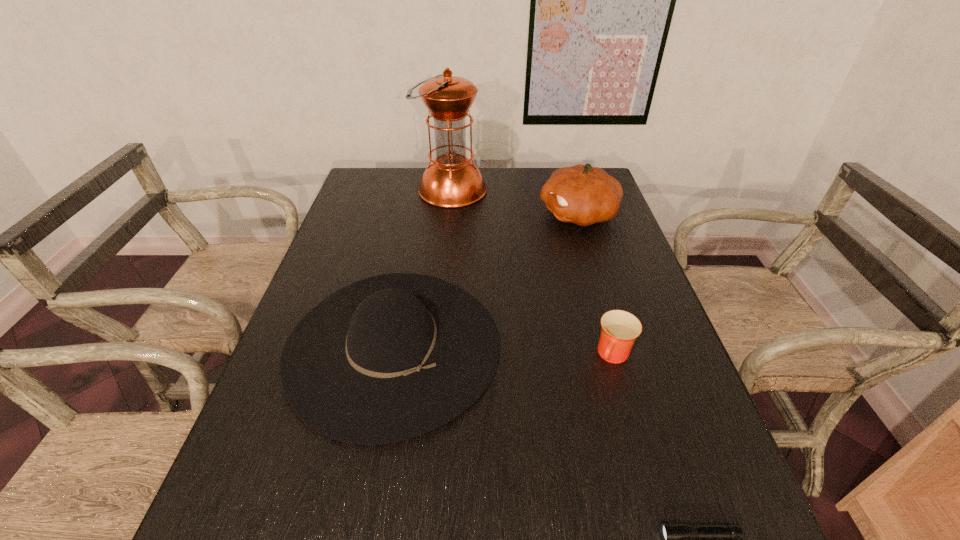
Image resolution: width=960 pixels, height=540 pixels. Identify the location of the tallest object. click(x=451, y=180).

Find the location of a particular element. pumpkin is located at coordinates (581, 194).

Identify the location of sombrero. (388, 358).

The image size is (960, 540). What are the coordinates of `the second shortest object` in the screenshot? It's located at (620, 329).

Locate an element on the screen. The height and width of the screenshot is (540, 960). vacant region located on the left of the tallest object is located at coordinates (383, 191).

The image size is (960, 540). Identify the location of blank area located on the front face of the fourth shortest object. (437, 214).

The height and width of the screenshot is (540, 960). Identify the location of free space located on the front face of the fourth shortest object. (458, 214).

Identify the location of free space located 0.170m on the front face of the fourth shortest object. (486, 214).

This screenshot has width=960, height=540. In order to click on free space located on the front-facing side of the sombrero in this screenshot , I will do `click(366, 490)`.

At what (x,y) coordinates should I click in order to perform the action: click on free region located 0.380m on the back of the second shortest object. Please return your answer as a coordinate pair (x, y). The image size is (960, 540). Looking at the image, I should click on (581, 242).